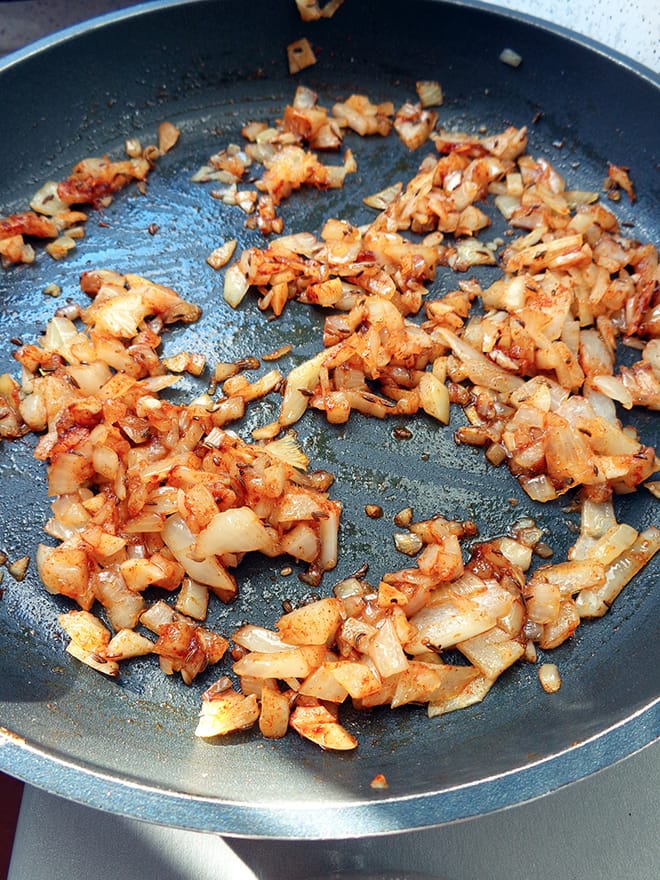
Locate an element on the screen. white and black marble countertop is located at coordinates (612, 19).